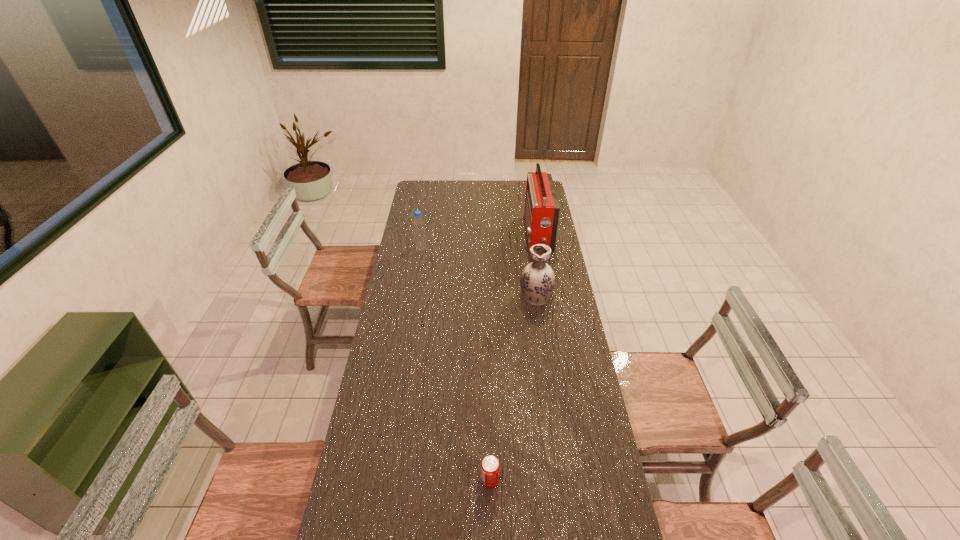
Select which object appears as the second closest to the radio receiver. Please provide its 2D coordinates. Your answer should be formatted as a tuple, i.e. [(x, y)], where the tuple contains the x and y coordinates of a point satisfying the conditions above.

[(418, 223)]

The image size is (960, 540). I want to click on object that ranks as the second closest to the nearest object, so click(541, 214).

This screenshot has height=540, width=960. Identify the location of free space that satisfies the following two spatial constraints: 1. on the front side of the shortest object; 2. on the right side of the water bottle. (383, 481).